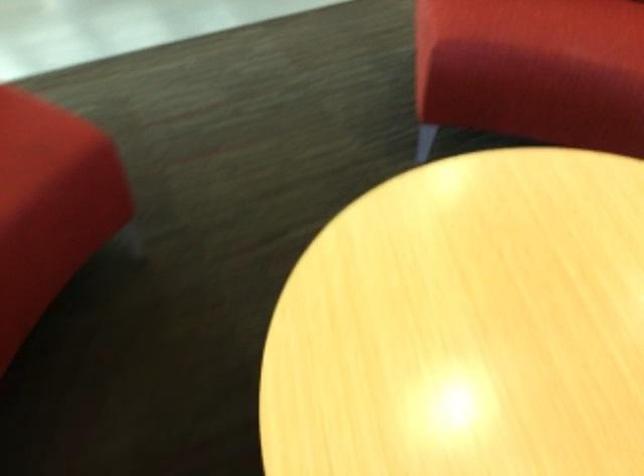
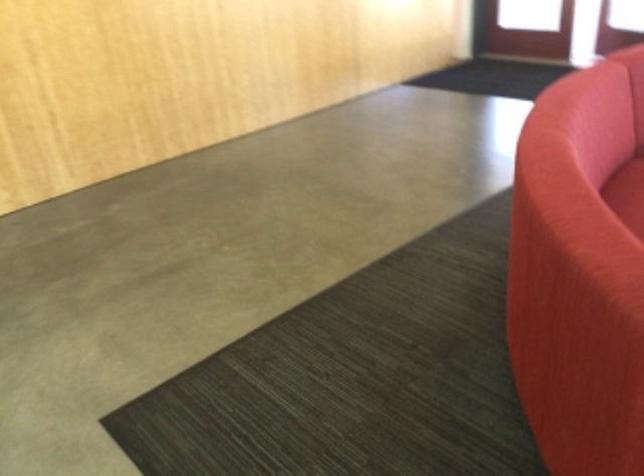
Question: Which direction would the cameraman need to move to produce the second image? Reply with the corresponding letter.

Choices:
 (A) Left
 (B) Right
 (C) Forward
 (D) Backward

Answer: (D)